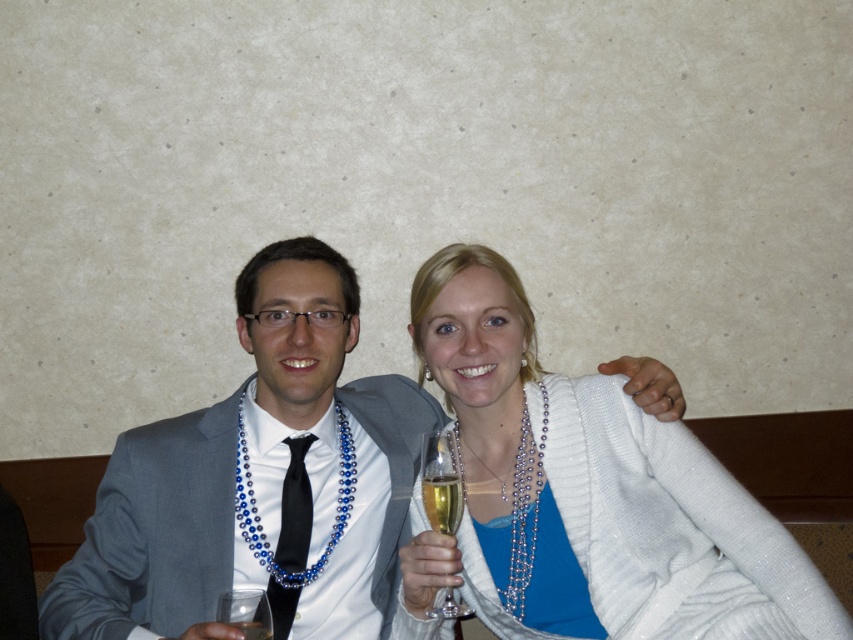
Is point (434, 460) positioned before point (263, 620)?

No.

Between clear glass wine glass at center and clear glass at center, which one has more height?

Standing taller between the two is clear glass wine glass at center.

The width and height of the screenshot is (853, 640). What do you see at coordinates (440, 483) in the screenshot?
I see `clear glass wine glass at center` at bounding box center [440, 483].

Find the location of a particular element. The height and width of the screenshot is (640, 853). clear glass wine glass at center is located at coordinates (440, 483).

Between white glittery sweater at upper right and clear glass at center, which one appears on the right side from the viewer's perspective?

Positioned to the right is white glittery sweater at upper right.

Is white glittery sweater at upper right smaller than clear glass at center?

Incorrect, white glittery sweater at upper right is not smaller in size than clear glass at center.

Does point (415, 518) come in front of point (248, 628)?

No.

The width and height of the screenshot is (853, 640). What are the coordinates of `white glittery sweater at upper right` in the screenshot? It's located at (584, 492).

You are a GUI agent. You are given a task and a screenshot of the screen. Output one action in this format:
    pyautogui.click(x=<x>, y=<y>)
    Task: Click on the black satin tie at center
    The width and height of the screenshot is (853, 640).
    Given the screenshot: What is the action you would take?
    pyautogui.click(x=294, y=508)

Can you confirm if black satin tie at center is positioned above clear glass wine glass at lower left?

Yes, black satin tie at center is above clear glass wine glass at lower left.

Is point (282, 564) behind point (263, 614)?

Yes, it is.

Locate an element on the screen. This screenshot has height=640, width=853. black satin tie at center is located at coordinates [x=294, y=508].